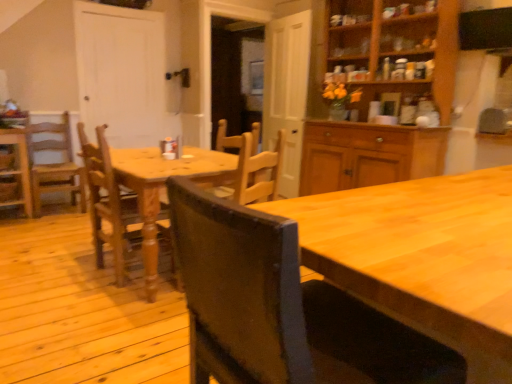
You are a GUI agent. You are given a task and a screenshot of the screen. Output one action in this format:
    pyautogui.click(x=<x>, y=<y>)
    Task: Click on the free location to the left of wooden chair at center, placed as the third chair when sorted from left to right
    This screenshot has height=384, width=512.
    Given the screenshot: What is the action you would take?
    pyautogui.click(x=66, y=273)